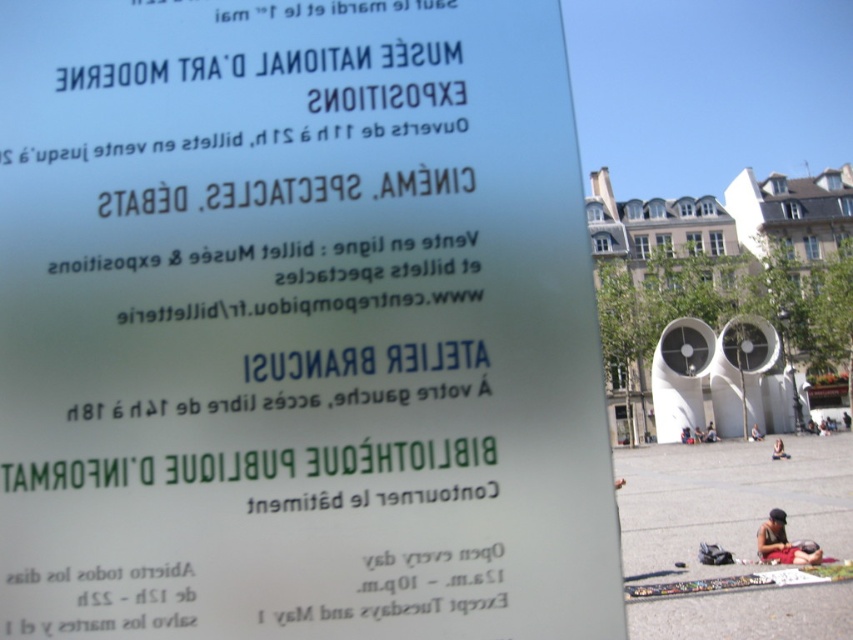
Find the location of `transparent glass sign at upper center`. transparent glass sign at upper center is located at coordinates (297, 324).

Is point (83, 260) positioned behind point (712, 442)?

No, it is in front of (712, 442).

Image resolution: width=853 pixels, height=640 pixels. Find the location of `transparent glass sign at upper center`. transparent glass sign at upper center is located at coordinates (297, 324).

Is point (711, 428) closer to camera compared to point (757, 435)?

Yes.

Is dark blue jeans at lower center wider than dark blue fabric at center?

Correct, the width of dark blue jeans at lower center exceeds that of dark blue fabric at center.

Between point (718, 438) and point (752, 433), which one is positioned in front?

Point (752, 433) is more forward.

Find the location of a particular element. dark blue jeans at lower center is located at coordinates (711, 433).

Is point (781, 451) closer to viewer compared to point (752, 436)?

Yes, it is in front of point (752, 436).

Who is more forward, (x=778, y=440) or (x=753, y=440)?

Positioned in front is point (x=778, y=440).

Locate an element on the screen. The width and height of the screenshot is (853, 640). dark blue fabric at lower right is located at coordinates (779, 451).